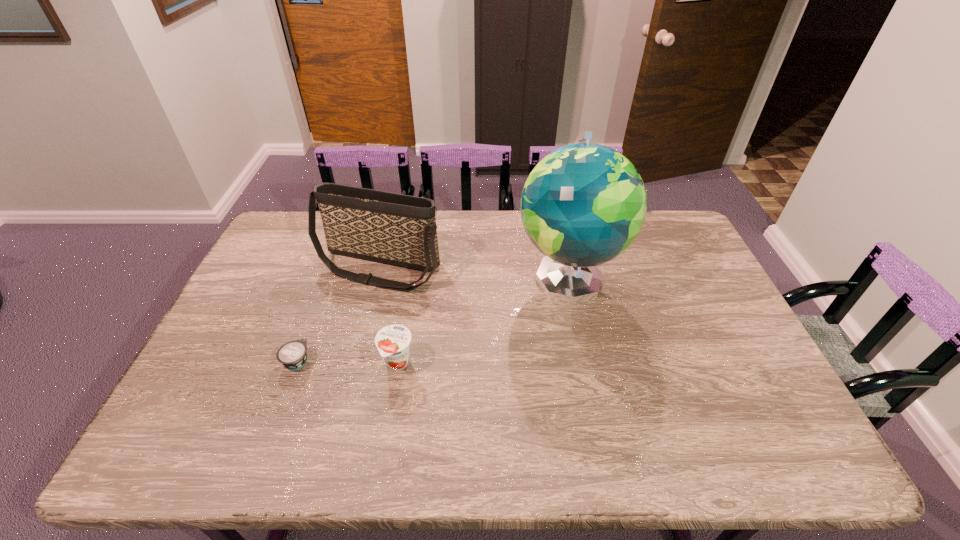
Locate an element on the screen. vacant space situated on the front of the shortest object is located at coordinates (286, 390).

This screenshot has width=960, height=540. I want to click on globe positioned at the far edge, so click(x=584, y=204).

You are a GUI agent. You are given a task and a screenshot of the screen. Output one action in this format:
    pyautogui.click(x=<x>, y=<y>)
    Task: Click on the handbag that is at the far edge
    
    Given the screenshot: What is the action you would take?
    pyautogui.click(x=391, y=228)

The image size is (960, 540). In the image, there is a desktop. In order to click on free space at the far edge in this screenshot , I will do `click(498, 217)`.

Identify the location of vacant space at the near edge of the desktop. (705, 437).

Locate an element on the screen. The image size is (960, 540). vacant space at the left edge is located at coordinates (246, 329).

Find the location of `blank space at the right edge of the desktop`. blank space at the right edge of the desktop is located at coordinates (680, 314).

The width and height of the screenshot is (960, 540). I want to click on vacant area at the far left corner of the desktop, so click(x=273, y=246).

The image size is (960, 540). I want to click on vacant space at the far right corner of the desktop, so click(668, 226).

Image resolution: width=960 pixels, height=540 pixels. Find the location of `vacant space at the near right corner of the desktop`. vacant space at the near right corner of the desktop is located at coordinates (780, 434).